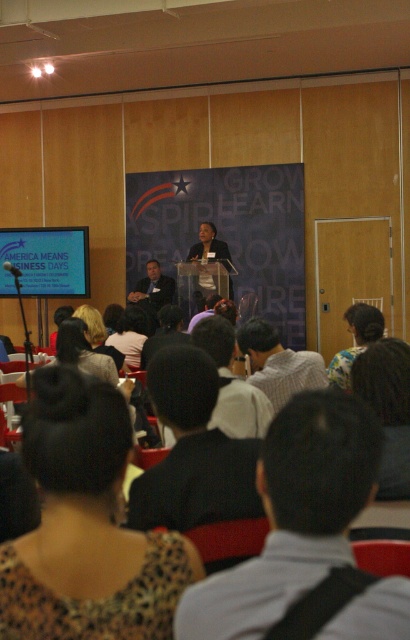
You are organizing a photo shoot and need to decide which clothing item to feature first. Based on the image, which clothing item has a narrower width between leopard print blouse at lower left and white shirt at center?

The leopard print blouse at lower left is thinner than the white shirt at center, so it has a narrower width and should be featured first.

You are organizing a photo shoot and need to decide which clothing item to feature first. Based on the image, which item is narrower between the light gray shirt at center and the fluffy white sweater at center?

The light gray shirt at center is thinner than the fluffy white sweater at center, so the light gray shirt at center is narrower.